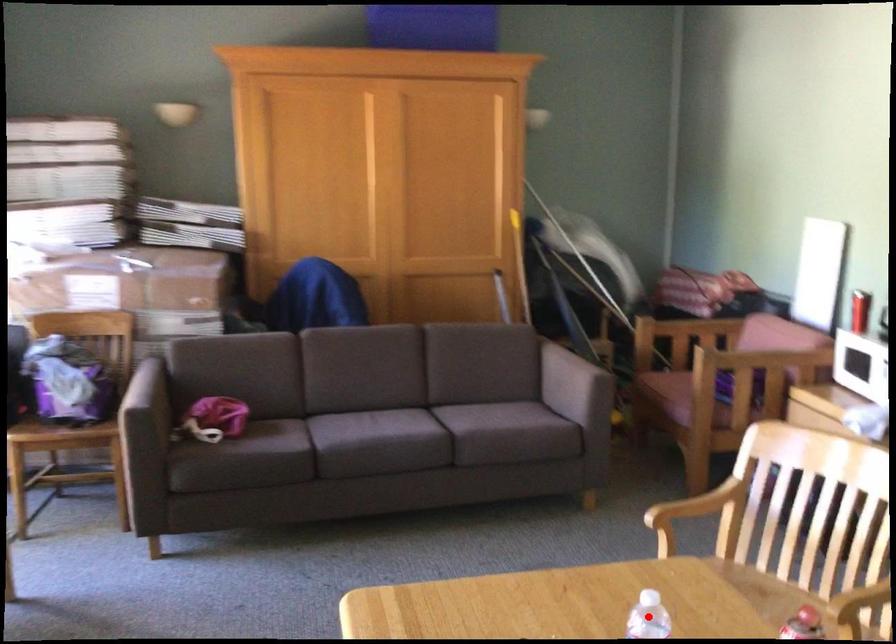
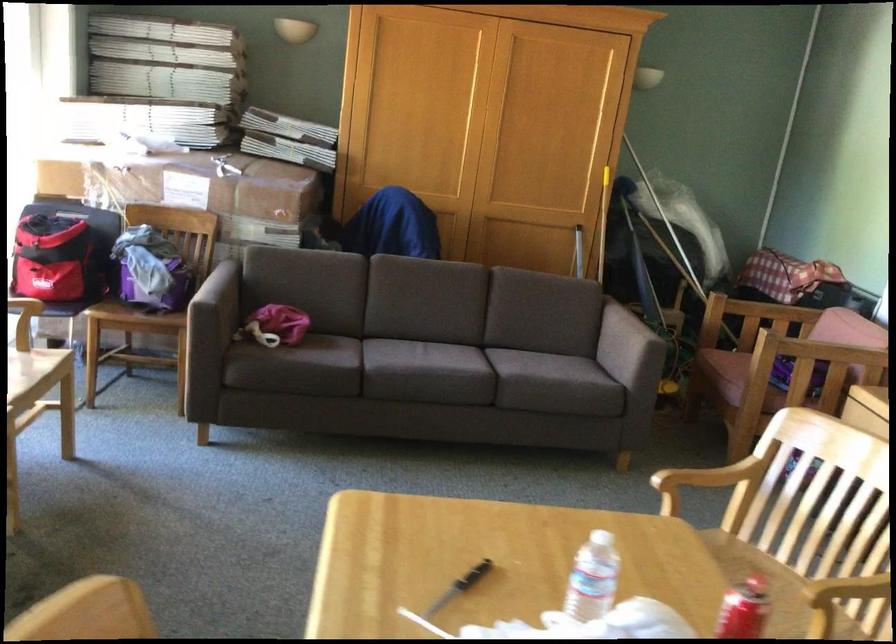
Question: I am providing you with two images of the same scene from different viewpoints. Given a red point in image1, look at the same physical point in image2. Is it:

Choices:
 (A) Closer to the viewpoint
 (B) Farther from the viewpoint

Answer: (B)